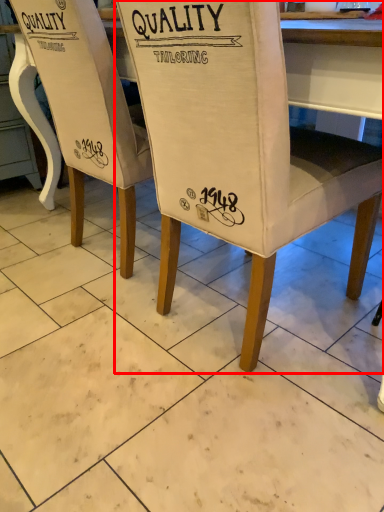
Question: From the image's perspective, where is chair (annotated by the red box) located relative to chair?

Choices:
 (A) above
 (B) below

Answer: (B)